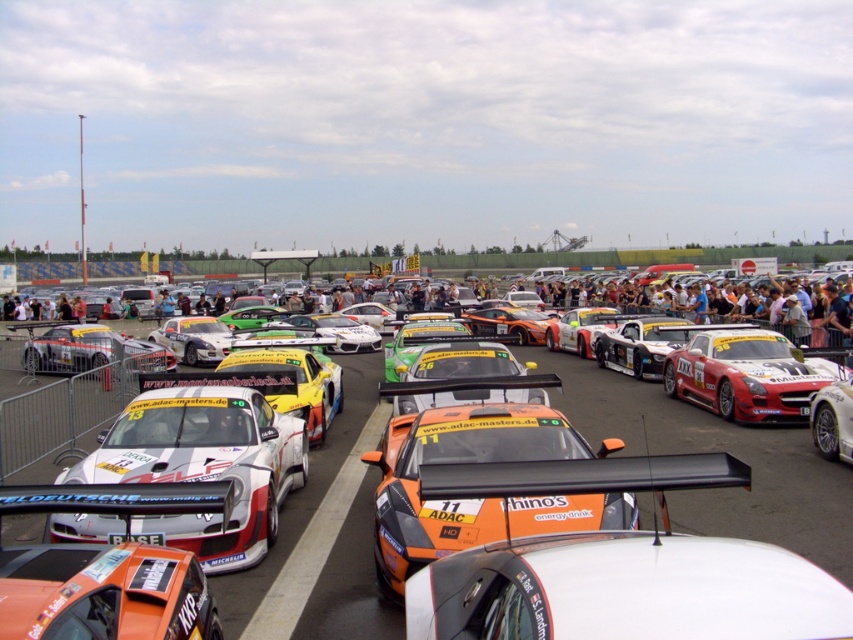
You are a photographer at the motorsport event. You want to capture a photo of both the orange matte race car at center and the orange glossy race car at center. Given their spatial relationship, which car should you position closer to the edge of your frame to include both in the shot?

Since the orange matte race car at center occupies less space than the orange glossy race car at center, you should position the orange matte race car at center closer to the edge of your frame to accommodate the larger size of the orange glossy race car at center and ensure both fit within the shot.

You are a photographer positioned at the front of the race grid. You want to capture a photo that includes both the white glossy race car at center and the red matte sports car at center. Since you can only focus on one car at a time, which car should you focus on to ensure the other is still in the frame?

You should focus on the white glossy race car at center because it is positioned to the left of the red matte sports car at center, so keeping it in focus will naturally include the red matte sports car at center in the frame as well.